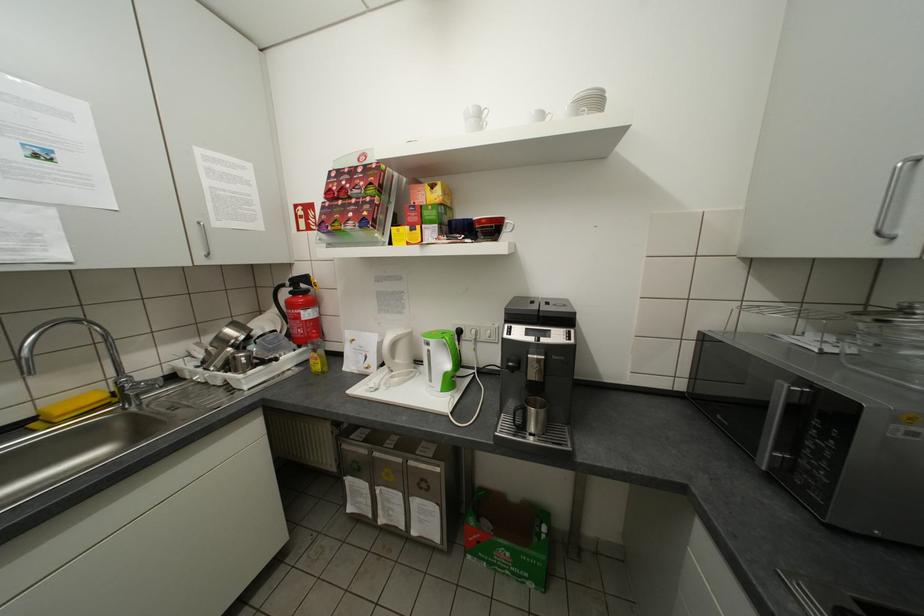
The image size is (924, 616). I want to click on microwave door handle, so click(774, 421).